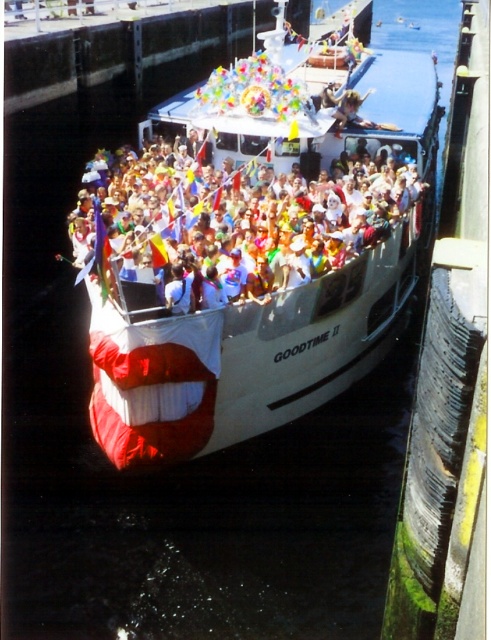
Question: Which point is closer to the camera taking this photo?

Choices:
 (A) (117, 172)
 (B) (396, 138)

Answer: (A)

Question: Which point is closer to the camera?

Choices:
 (A) (229, 83)
 (B) (77, 214)

Answer: (B)

Question: Can you confirm if white matte boat at center is positioned to the right of multicolored fabric crowd at center?

Choices:
 (A) yes
 (B) no

Answer: (A)

Question: Can you confirm if white matte boat at center is thinner than multicolored fabric crowd at center?

Choices:
 (A) no
 (B) yes

Answer: (A)

Question: Is white matte boat at center below multicolored fabric crowd at center?

Choices:
 (A) no
 (B) yes

Answer: (A)